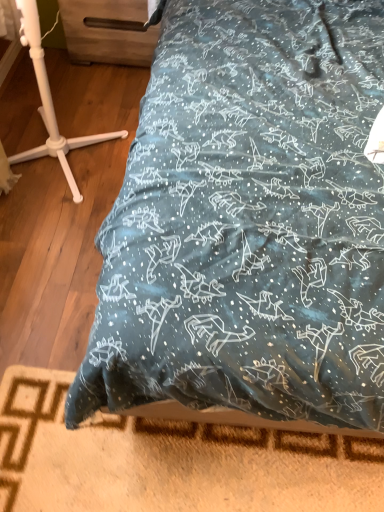
Locate an element on the screen. teal fabric bed at center is located at coordinates (249, 222).

What is the approximate width of teal fabric bed at center?

It is 7.94 feet.

This screenshot has height=512, width=384. What do you see at coordinates (108, 31) in the screenshot?
I see `wooden drawer at upper left` at bounding box center [108, 31].

Where is `teal fabric bed at center`? Image resolution: width=384 pixels, height=512 pixels. teal fabric bed at center is located at coordinates coord(249,222).

From the image's perspective, is white plastic tripod at left beneath wooden drawer at upper left?

Yes, from the image's perspective, white plastic tripod at left is below wooden drawer at upper left.

Relative to wooden drawer at upper left, is white plastic tripod at left in front or behind?

Clearly, white plastic tripod at left is in front of wooden drawer at upper left.

From a real-world perspective, is white plastic tripod at left over wooden drawer at upper left?

Indeed, from a real-world perspective, white plastic tripod at left stands above wooden drawer at upper left.

Is there a large distance between white plastic tripod at left and wooden drawer at upper left?

No, there isn't a large distance between white plastic tripod at left and wooden drawer at upper left.

From the image's perspective, which one is positioned lower, white plastic tripod at left or teal fabric bed at center?

teal fabric bed at center is shown below in the image.

Considering the positions of objects white plastic tripod at left and teal fabric bed at center in the image provided, who is behind, white plastic tripod at left or teal fabric bed at center?

teal fabric bed at center is more distant.

From the picture: Can you confirm if white plastic tripod at left is shorter than teal fabric bed at center?

No.

Is wooden drawer at upper left not near teal fabric bed at center?

No, there isn't a large distance between wooden drawer at upper left and teal fabric bed at center.

Consider the image. Considering the sizes of objects wooden drawer at upper left and teal fabric bed at center in the image provided, who is smaller, wooden drawer at upper left or teal fabric bed at center?

Smaller between the two is wooden drawer at upper left.

How much distance is there between wooden drawer at upper left and teal fabric bed at center?

They are 38.97 inches apart.

Which is correct: wooden drawer at upper left is inside teal fabric bed at center, or outside of it?

wooden drawer at upper left is spatially situated outside teal fabric bed at center.

Which object is closer to the camera, teal fabric bed at center or wooden bed frame at lower center?

teal fabric bed at center is in front.

Can you confirm if teal fabric bed at center is smaller than wooden bed frame at lower center?

No, teal fabric bed at center is not smaller than wooden bed frame at lower center.

Which is more distant, (255,288) or (316,462)?

The point (316,462) is farther.

Is teal fabric bed at center far away from wooden bed frame at lower center?

That's not correct — teal fabric bed at center is a little close to wooden bed frame at lower center.

Consider the image. Can you confirm if white plastic tripod at left is smaller than wooden bed frame at lower center?

Actually, white plastic tripod at left might be larger than wooden bed frame at lower center.

From a real-world perspective, is white plastic tripod at left located higher than wooden bed frame at lower center?

Yes, from a real-world perspective, white plastic tripod at left is on top of wooden bed frame at lower center.

Measure the distance between white plastic tripod at left and wooden bed frame at lower center.

white plastic tripod at left is 38.92 inches away from wooden bed frame at lower center.

Is white plastic tripod at left positioned far away from wooden bed frame at lower center?

No, white plastic tripod at left is in close proximity to wooden bed frame at lower center.

Considering the sizes of wooden bed frame at lower center and wooden drawer at upper left in the image, is wooden bed frame at lower center wider or thinner than wooden drawer at upper left?

wooden bed frame at lower center is thinner than wooden drawer at upper left.

Who is smaller, wooden bed frame at lower center or wooden drawer at upper left?

Smaller between the two is wooden bed frame at lower center.

From the picture: Could you tell me if wooden bed frame at lower center is turned towards wooden drawer at upper left?

No, wooden bed frame at lower center does not turn towards wooden drawer at upper left.

From a real-world perspective, is wooden drawer at upper left physically below white plastic tripod at left?

Yes, from a real-world perspective, wooden drawer at upper left is below white plastic tripod at left.

From their relative heights in the image, would you say wooden drawer at upper left is taller or shorter than white plastic tripod at left?

In the image, wooden drawer at upper left appears to be shorter than white plastic tripod at left.

Is white plastic tripod at left at the back of wooden drawer at upper left?

No, wooden drawer at upper left is not facing the opposite direction of white plastic tripod at left.

This screenshot has width=384, height=512. Identify the location of furniture lying on the left of wooden drawer at upper left. (50, 103).

The height and width of the screenshot is (512, 384). Find the location of `furniture that appears in front of the teal fabric bed at center`. furniture that appears in front of the teal fabric bed at center is located at coordinates (50, 103).

Consider the image. Considering their positions, is teal fabric bed at center positioned closer to wooden bed frame at lower center than wooden drawer at upper left?

teal fabric bed at center is positioned closer to the anchor wooden bed frame at lower center.

Considering their positions, is wooden bed frame at lower center positioned further to white plastic tripod at left than wooden drawer at upper left?

Among the two, wooden bed frame at lower center is located further to white plastic tripod at left.

Estimate the real-world distances between objects in this image. Which object is further from wooden bed frame at lower center, teal fabric bed at center or white plastic tripod at left?

white plastic tripod at left.

When comparing their distances from white plastic tripod at left, does wooden drawer at upper left or wooden bed frame at lower center seem further?

wooden bed frame at lower center.

Based on the photo, estimate the real-world distances between objects in this image. Which object is closer to teal fabric bed at center, wooden bed frame at lower center or wooden drawer at upper left?

wooden bed frame at lower center is positioned closer to the anchor teal fabric bed at center.

Estimate the real-world distances between objects in this image. Which object is further from wooden drawer at upper left, teal fabric bed at center or wooden bed frame at lower center?

wooden bed frame at lower center.

Based on their spatial positions, is white plastic tripod at left or wooden drawer at upper left further from wooden bed frame at lower center?

wooden drawer at upper left lies further to wooden bed frame at lower center than the other object.

Consider the image. Looking at the image, which one is located further to white plastic tripod at left, wooden bed frame at lower center or teal fabric bed at center?

wooden bed frame at lower center is further to white plastic tripod at left.

Where is `bed between white plastic tripod at left and wooden bed frame at lower center from top to bottom`? bed between white plastic tripod at left and wooden bed frame at lower center from top to bottom is located at coordinates (249, 222).

Identify the location of bed between wooden drawer at upper left and wooden bed frame at lower center from top to bottom. (249, 222).

Where is `bed between white plastic tripod at left and wooden drawer at upper left in the front-back direction`? This screenshot has width=384, height=512. bed between white plastic tripod at left and wooden drawer at upper left in the front-back direction is located at coordinates (249, 222).

Where is `furniture between wooden drawer at upper left and wooden bed frame at lower center vertically`? The width and height of the screenshot is (384, 512). furniture between wooden drawer at upper left and wooden bed frame at lower center vertically is located at coordinates (50, 103).